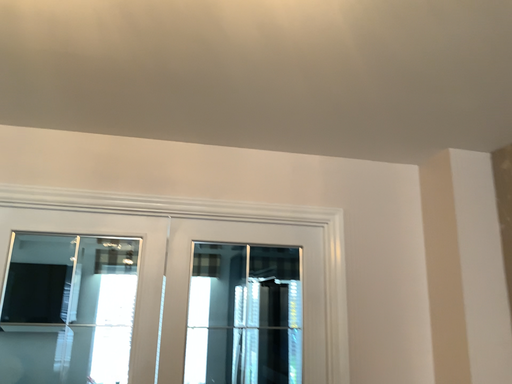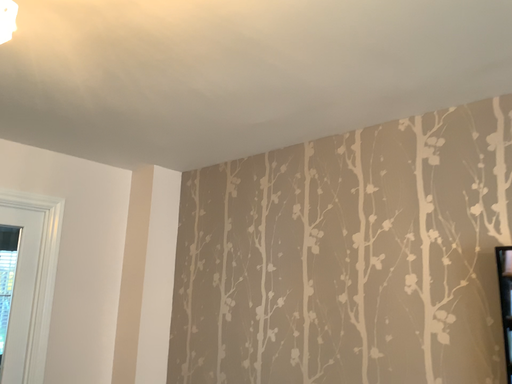
Question: Which way did the camera rotate in the video?

Choices:
 (A) rotated upward
 (B) rotated downward

Answer: (B)